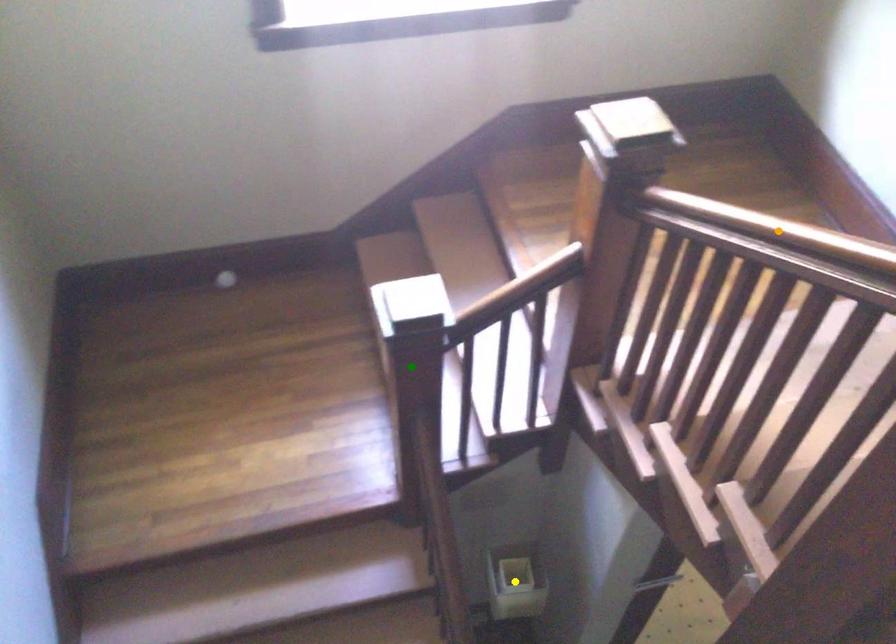
Order these from nearest to farthest:
- green point
- yellow point
- orange point

orange point < green point < yellow point